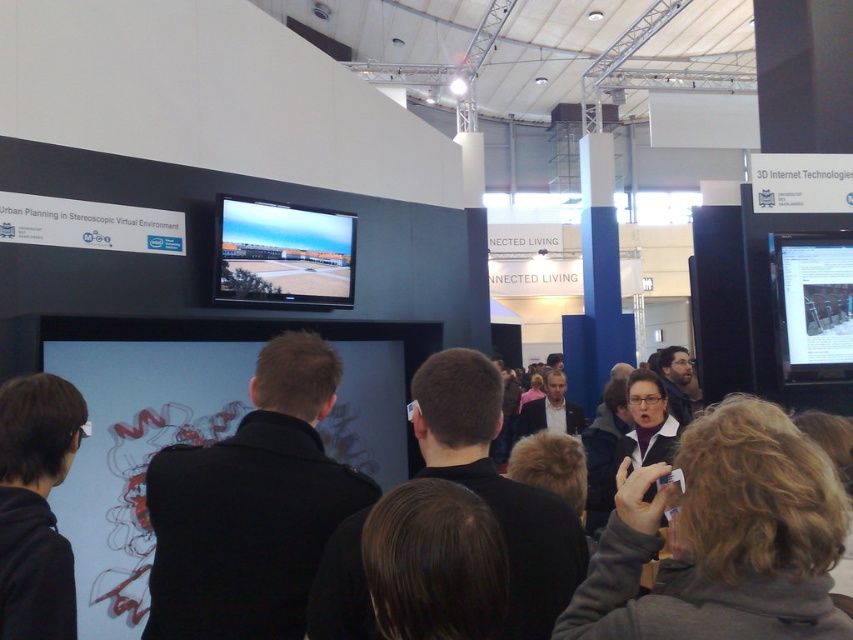
Which of these two, black matte jacket at lower left or matte black screen at upper right, stands taller?

matte black screen at upper right is taller.

Where is `black matte jacket at lower left`? The width and height of the screenshot is (853, 640). black matte jacket at lower left is located at coordinates (36, 506).

How much distance is there between black matte jacket at center and black matte jacket at lower left?

black matte jacket at center is 12.08 inches away from black matte jacket at lower left.

Which is behind, point (225, 474) or point (18, 448)?

Positioned behind is point (18, 448).

At what (x,y) coordinates should I click in order to perform the action: click on black matte jacket at center. Please return your answer as a coordinate pair (x, y). The image size is (853, 640). Looking at the image, I should click on (251, 506).

Measure the distance between black matte jacket at center and matte black screen at upper center.

A distance of 8.17 feet exists between black matte jacket at center and matte black screen at upper center.

In the scene shown: How distant is black matte jacket at center from matte black screen at upper center?

black matte jacket at center is 2.49 meters away from matte black screen at upper center.

Where is `black matte jacket at center`? This screenshot has height=640, width=853. black matte jacket at center is located at coordinates (251, 506).